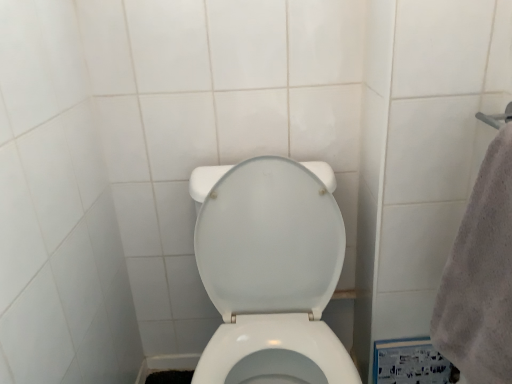
Measure the distance between point (487,157) and camera.

The distance of point (487,157) from camera is 78.50 centimeters.

Find the location of `gray fluffy towel at right`. gray fluffy towel at right is located at coordinates (481, 276).

Describe the element at coordinates (481, 276) in the screenshot. I see `gray fluffy towel at right` at that location.

Where is `white glossy toilet at center`? white glossy toilet at center is located at coordinates (272, 274).

Describe the element at coordinates (272, 274) in the screenshot. I see `white glossy toilet at center` at that location.

In order to face white glossy toilet at center, should I rotate leftwards or rightwards?

It's best to rotate right around 2.075 degrees.

Locate an element on the screen. gray fluffy towel at right is located at coordinates (481, 276).

Consider the image. Which is more to the left, gray fluffy towel at right or white glossy toilet at center?

white glossy toilet at center is more to the left.

Is gray fluffy towel at right in front of or behind white glossy toilet at center in the image?

Clearly, gray fluffy towel at right is in front of white glossy toilet at center.

Which point is more distant from viewer, (510, 277) or (332, 249)?

The point (332, 249) is farther.

From the image's perspective, is gray fluffy towel at right located above white glossy toilet at center?

Yes.

From a real-world perspective, between gray fluffy towel at right and white glossy toilet at center, who is vertically lower?

In real-world perspective, white glossy toilet at center is lower.

Which object is thinner, gray fluffy towel at right or white glossy toilet at center?

gray fluffy towel at right.

In terms of height, does gray fluffy towel at right look taller or shorter compared to white glossy toilet at center?

gray fluffy towel at right is shorter than white glossy toilet at center.

Does gray fluffy towel at right have a smaller size compared to white glossy toilet at center?

Yes, gray fluffy towel at right is smaller than white glossy toilet at center.

Which is correct: gray fluffy towel at right is inside white glossy toilet at center, or outside of it?

gray fluffy towel at right is spatially situated outside white glossy toilet at center.

Are gray fluffy towel at right and white glossy toilet at center beside each other?

No, gray fluffy towel at right is not next to white glossy toilet at center.

Is gray fluffy towel at right facing away from white glossy toilet at center?

No.

Consider the image. How different are the orientations of gray fluffy towel at right and white glossy toilet at center in degrees?

They differ by 89.5 degrees in their facing directions.

How far apart are gray fluffy towel at right and white glossy toilet at center?

They are 14.30 inches apart.

Find the location of a particular element. The width and height of the screenshot is (512, 384). toilet below the gray fluffy towel at right (from a real-world perspective) is located at coordinates (272, 274).

Consider the image. Considering the positions of objects white glossy toilet at center and gray fluffy towel at right in the image provided, who is more to the left, white glossy toilet at center or gray fluffy towel at right?

From the viewer's perspective, white glossy toilet at center appears more on the left side.

Looking at this image, considering their positions, is white glossy toilet at center located in front of or behind gray fluffy towel at right?

Visually, white glossy toilet at center is located behind gray fluffy towel at right.

Which is behind, point (238, 200) or point (498, 372)?

The point (238, 200) is behind.

From the image's perspective, is white glossy toilet at center below gray fluffy towel at right?

Indeed, from the image's perspective, white glossy toilet at center is shown beneath gray fluffy towel at right.

From a real-world perspective, is white glossy toilet at center above or below gray fluffy towel at right?

In terms of real-world spatial position, white glossy toilet at center is below gray fluffy towel at right.

Which object is thinner, white glossy toilet at center or gray fluffy towel at right?

With smaller width is gray fluffy towel at right.

From the picture: Between white glossy toilet at center and gray fluffy towel at right, which one has more height?

Standing taller between the two is white glossy toilet at center.

Between white glossy toilet at center and gray fluffy towel at right, which one has smaller size?

Smaller between the two is gray fluffy towel at right.

Is gray fluffy towel at right surrounded by white glossy toilet at center?

That's incorrect, gray fluffy towel at right is not inside white glossy toilet at center.

Is white glossy toilet at center not near gray fluffy towel at right?

white glossy toilet at center is near gray fluffy towel at right, not far away.

Is white glossy toilet at center positioned with its back to gray fluffy towel at right?

No, gray fluffy towel at right is not at the back of white glossy toilet at center.

Can you tell me how much white glossy toilet at center and gray fluffy towel at right differ in facing direction?

89.5 degrees separate the facing orientations of white glossy toilet at center and gray fluffy towel at right.

The height and width of the screenshot is (384, 512). In order to click on bath towel on the right of the white glossy toilet at center in this screenshot , I will do `click(481, 276)`.

The width and height of the screenshot is (512, 384). Find the location of `bath towel that is above the white glossy toilet at center (from the image's perspective)`. bath towel that is above the white glossy toilet at center (from the image's perspective) is located at coordinates (481, 276).

This screenshot has width=512, height=384. Find the location of `bath towel that is on the right side of white glossy toilet at center`. bath towel that is on the right side of white glossy toilet at center is located at coordinates (481, 276).